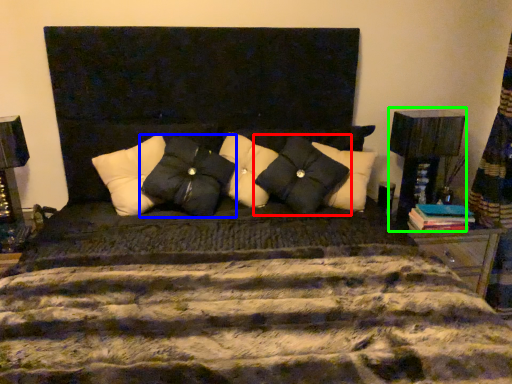
Question: Which is nearer to the pillow (highlighted by a red box)? pillow (highlighted by a blue box) or table lamp (highlighted by a green box).

Choices:
 (A) pillow
 (B) table lamp

Answer: (A)